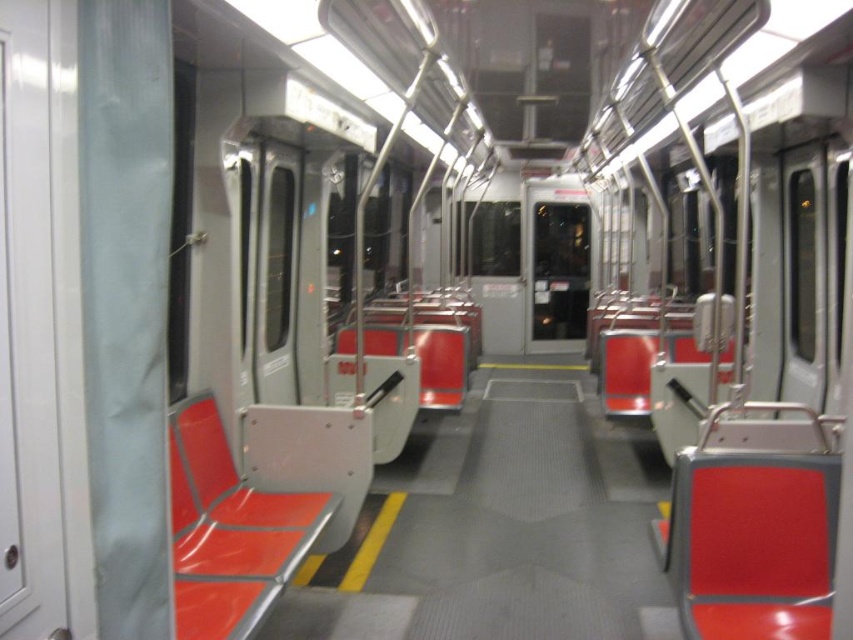
Can you confirm if matte red seat at center is positioned to the right of metallic red seat at center?

Indeed, matte red seat at center is positioned on the right side of metallic red seat at center.

How distant is matte red seat at center from metallic red seat at center?

The distance of matte red seat at center from metallic red seat at center is 1.76 meters.

Does point (776, 433) lie in front of point (241, 580)?

No, (776, 433) is further to viewer.

At what (x,y) coordinates should I click in order to perform the action: click on matte red seat at center. Please return your answer as a coordinate pair (x, y). Image resolution: width=853 pixels, height=640 pixels. Looking at the image, I should click on (753, 534).